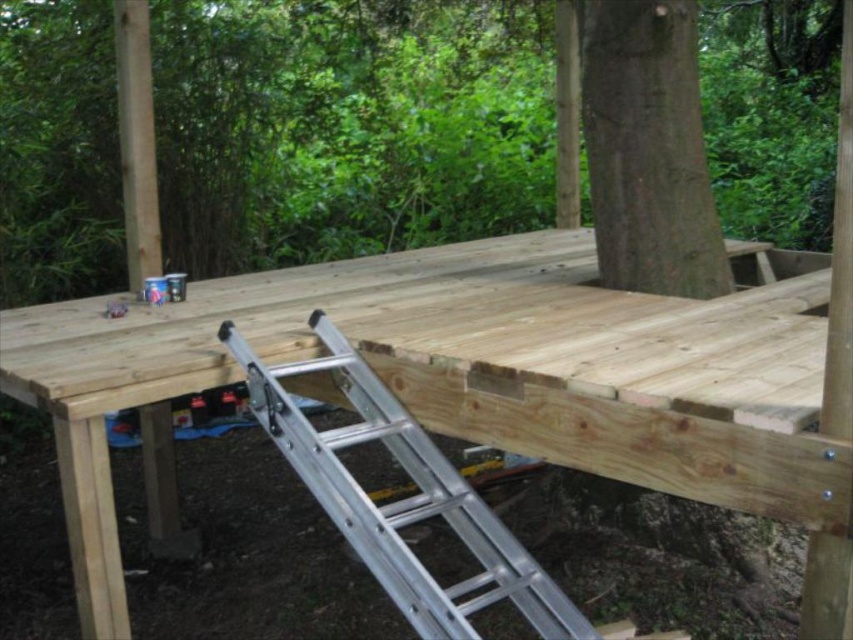
Question: Among these points, which one is farthest from the camera?

Choices:
 (A) tap(753, 291)
 (B) tap(544, 582)
 (C) tap(670, 234)

Answer: (A)

Question: Is brown wood tree at center below green rough bark tree at center?

Choices:
 (A) yes
 (B) no

Answer: (B)

Question: Can you confirm if brown wood tree at center is wider than green rough bark tree at center?

Choices:
 (A) no
 (B) yes

Answer: (A)

Question: Where is brown wood tree at center located in relation to natural wood picnic table at center in the image?

Choices:
 (A) above
 (B) below

Answer: (A)

Question: Which object is closer to the camera taking this photo?

Choices:
 (A) green rough bark tree at center
 (B) brown wood tree at center
 (C) natural wood picnic table at center

Answer: (C)

Question: Which of the following is the closest to the observer?

Choices:
 (A) coord(421,605)
 (B) coord(86,314)
 (C) coord(471,51)
 (D) coord(677,129)

Answer: (A)